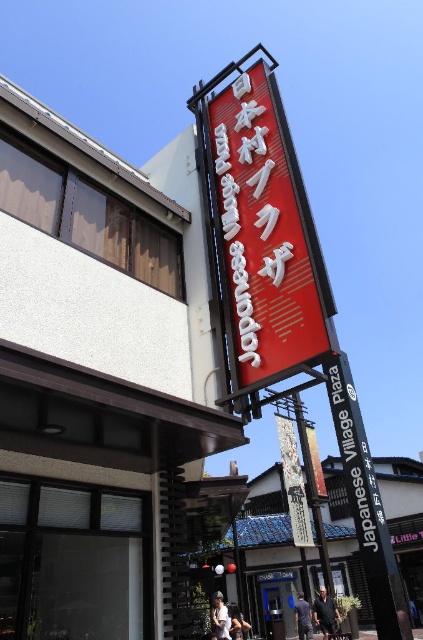
In the scene shown: You are a delivery person standing at the entrance of Japanese Village Plaza. You need to hand over a package to a person wearing dark blue jeans at center and blue fabric shirt at lower center. How far apart are the two items of clothing you need to deliver to?

The dark blue jeans at center is 24.58 inches away from the blue fabric shirt at lower center, so the distance between them is 24.58 inches.

From the picture: You are a tourist in Japan and see the black metal sign at center and the white paper sign at center. Which one is bigger?

The white paper sign at center is bigger than the black metal sign at center.

From the picture: You are standing in front of the Japanese Village Plaza and want to take a photo of the red matte sign at upper center and the white cotton shirt at lower center. Which object should you focus on first to ensure both are in the frame?

You should focus on the red matte sign at upper center first because it is closer to the viewer than the white cotton shirt at lower center, ensuring both are in the frame.